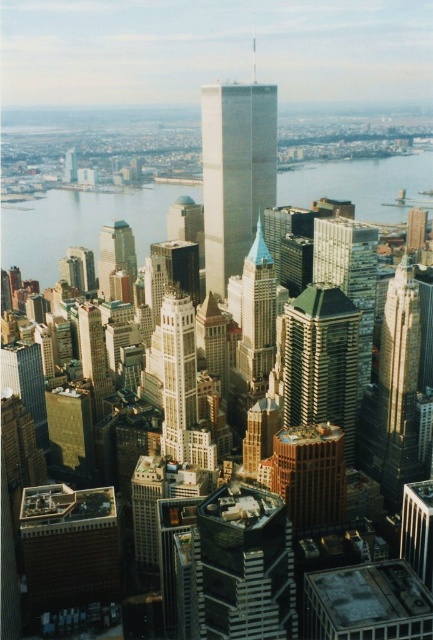
Question: Which point is closer to the camera taking this photo?

Choices:
 (A) (213, 284)
 (B) (300, 512)
 (C) (291, 634)

Answer: (C)

Question: Among these objects, which one is nearest to the camera?

Choices:
 (A) gold reflective tower at center
 (B) white marble skyscraper at center
 (C) green glass building at center
 (D) matte glass skyscraper at center-left

Answer: (B)

Question: Observing the image, what is the correct spatial positioning of white glass tower at center in reference to matte glass skyscraper at center-left?

Choices:
 (A) above
 (B) below

Answer: (A)

Question: Which object is closer to the camera taking this photo?

Choices:
 (A) matte glass skyscraper at center-left
 (B) gold reflective tower at center
 (C) clear blue water at center

Answer: (A)

Question: Is the position of green glass building at center less distant than that of white marble skyscraper at center?

Choices:
 (A) yes
 (B) no

Answer: (B)

Question: Can you confirm if gold reflective tower at center is positioned to the right of gold reflective building at center?

Choices:
 (A) no
 (B) yes

Answer: (A)